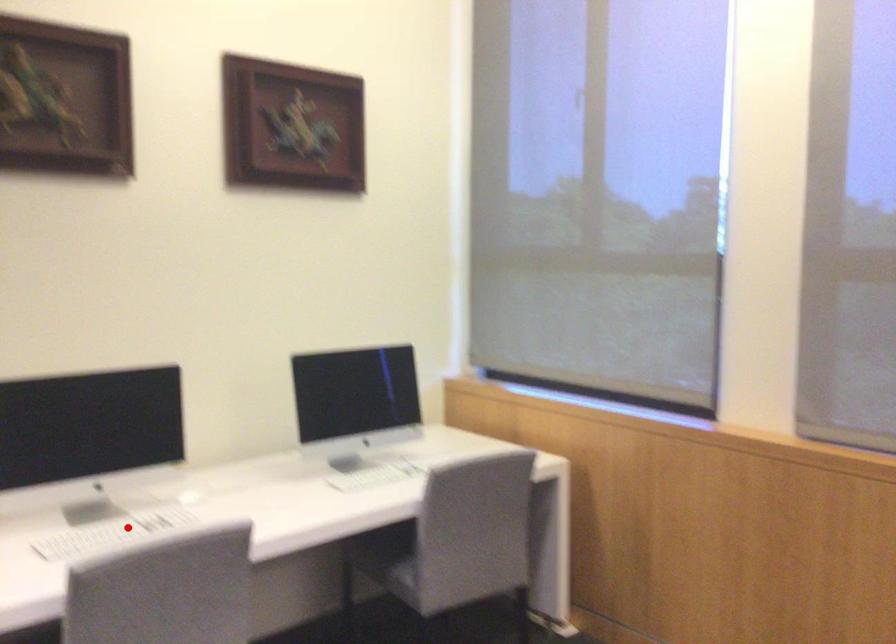
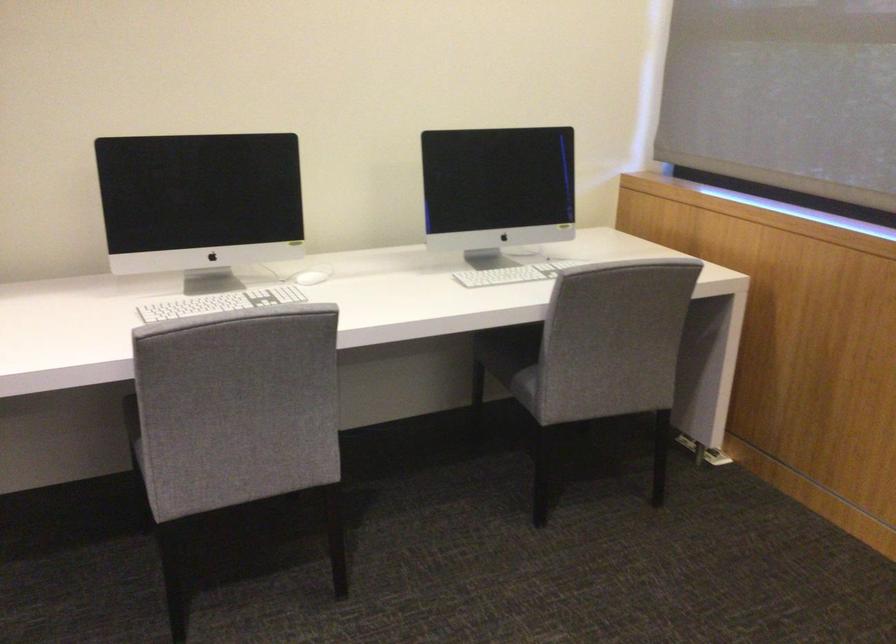
Find the pixel in the second image that matches the highlighted location in the first image.

(220, 303)